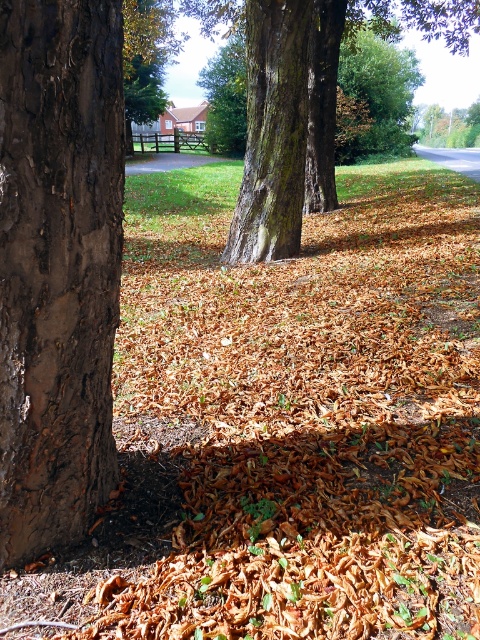
From the picture: You are standing in an autumn forest and want to touch both the brown rough bark at left and the smooth bark tree at center. Which tree should you approach first to reach the closer one?

You should approach the brown rough bark at left first because it is closer to the viewer than the smooth bark tree at center.

You are standing in the autumn scene and want to walk from the point at coordinates point (x=362, y=19) to the point at coordinates point (x=300, y=138). Which direction should you move to get closer to your destination?

Since point (x=362, y=19) is further to the viewer than point (x=300, y=138), you should move forward to get closer to your destination.

You are an artist sketching the scene and want to draw the brown rough bark at left and the smooth bark tree at center first. Which one should you draw first if you start from the left side of the paper?

You should draw the brown rough bark at left first because it is positioned to the left of the smooth bark tree at center.